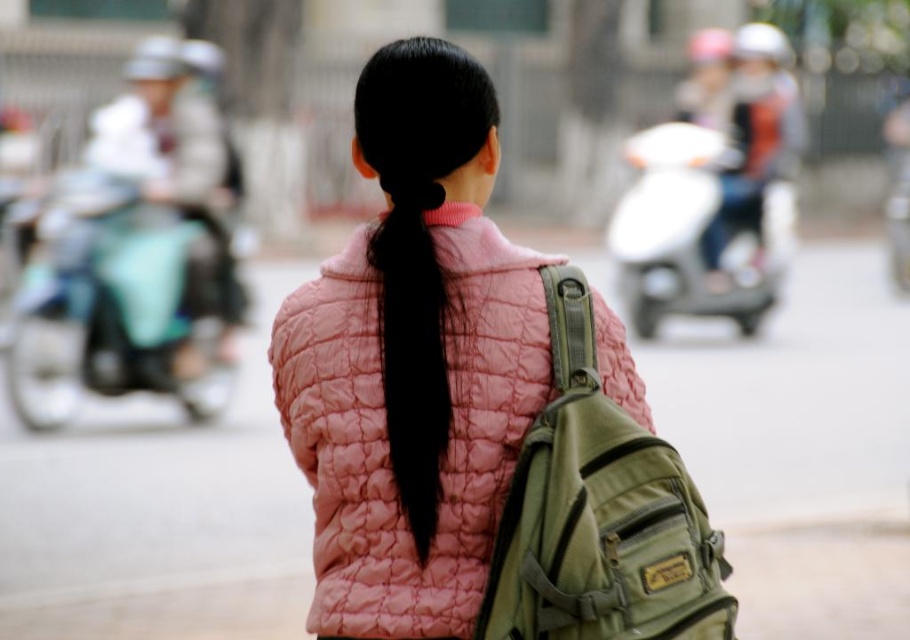
Question: Does olive green canvas backpack at center have a lesser width compared to black silky hair at center?

Choices:
 (A) no
 (B) yes

Answer: (A)

Question: Among these points, which one is nearest to the camera?

Choices:
 (A) (700, 211)
 (B) (553, 374)
 (C) (165, 212)

Answer: (B)

Question: Does teal matte motorcycle at left lie in front of black silky hair at center?

Choices:
 (A) yes
 (B) no

Answer: (B)

Question: Which point is closer to the camera taking this photo?

Choices:
 (A) (635, 232)
 (B) (446, 488)
 (C) (124, 200)
 (D) (427, 342)

Answer: (D)

Question: Can you confirm if olive green canvas backpack at center is positioned above teal matte motorcycle at left?

Choices:
 (A) yes
 (B) no

Answer: (B)

Question: Which of the following is the closest to the observer?

Choices:
 (A) olive green canvas backpack at center
 (B) teal matte motorcycle at left

Answer: (A)